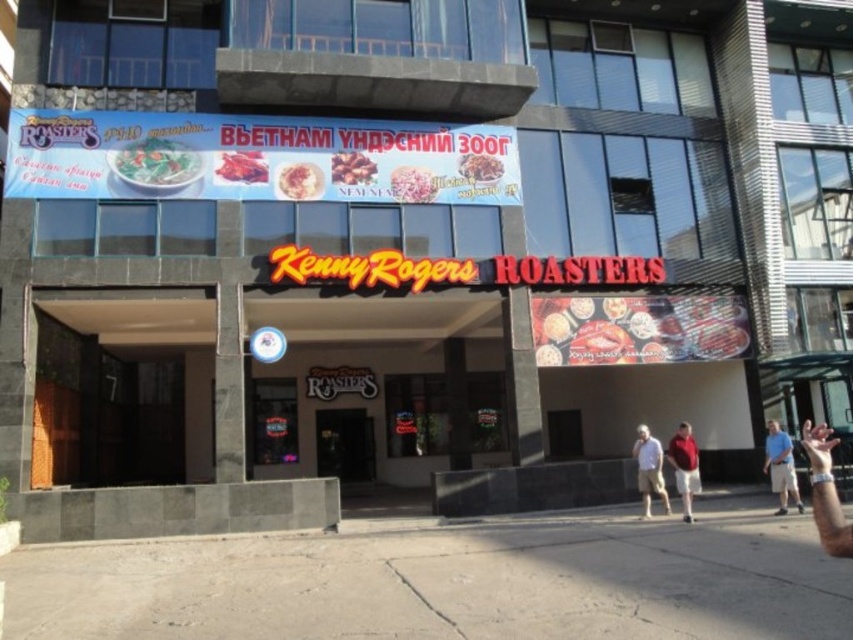
Consider the image. You are a customer standing outside the Kenny Rogers Roasters restaurant. You see the shiny plastic food at center and the smooth white rice at center. Which one is positioned lower?

The shiny plastic food at center is below the smooth white rice at center, so the shiny plastic food at center is positioned lower.